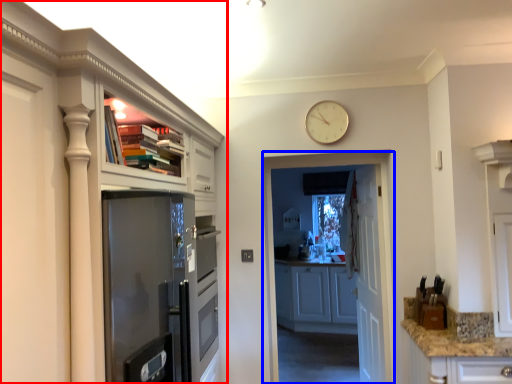
Question: Which object appears farthest to the camera in this image, cabinetry (highlighted by a red box) or screen door (highlighted by a blue box)?

Choices:
 (A) cabinetry
 (B) screen door

Answer: (B)